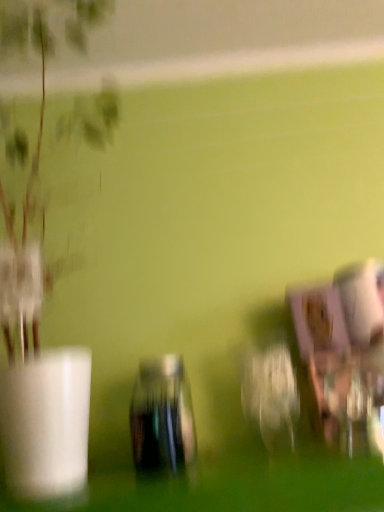
Question: Should I look upward or downward to see green leafy plant at left?

Choices:
 (A) down
 (B) up

Answer: (B)